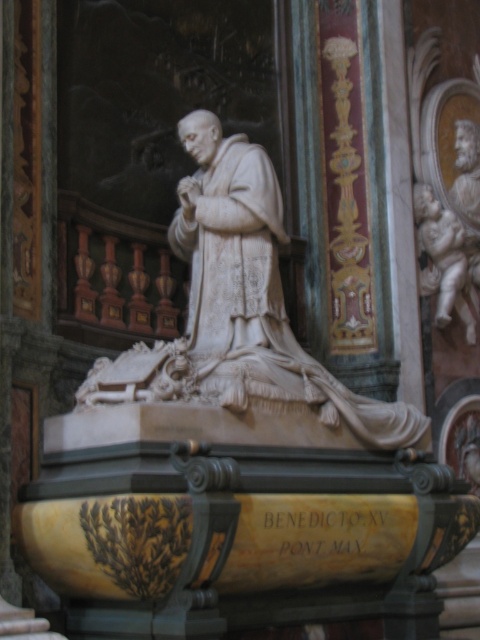
Does white marble statue at center lie behind white marble cherub at upper right?

No, it is not.

Does white marble statue at center have a greater width compared to white marble cherub at upper right?

Correct, the width of white marble statue at center exceeds that of white marble cherub at upper right.

Is point (156, 353) farther from camera compared to point (421, 236)?

No, (156, 353) is in front of (421, 236).

What are the coordinates of `white marble statue at center` in the screenshot? It's located at (238, 307).